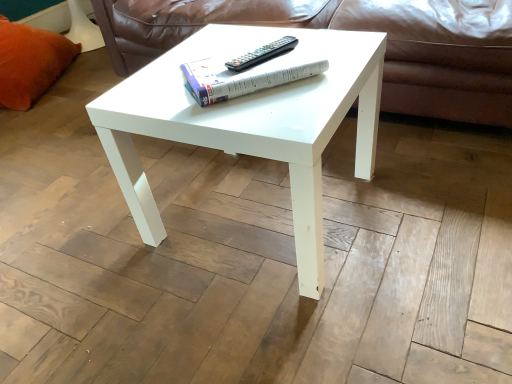
Identify the location of vacant region to the left of white paper at center. (154, 85).